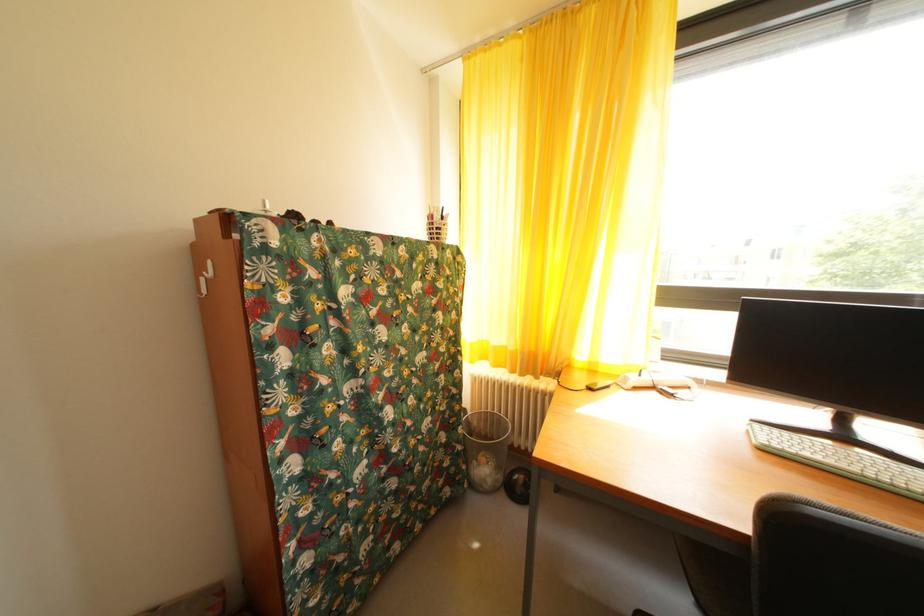
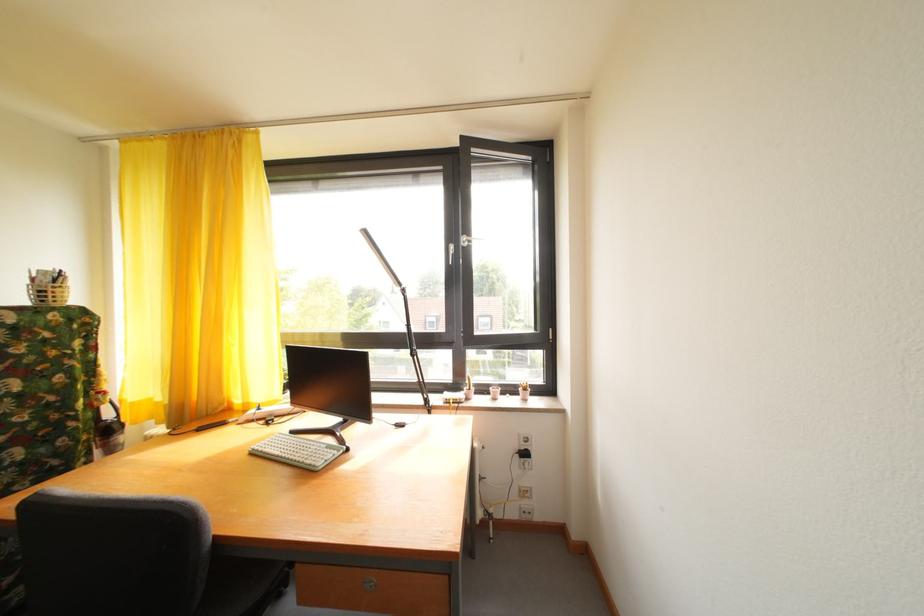
The point at (440, 223) is marked in the first image. Where is the corresponding point in the second image?

(43, 286)